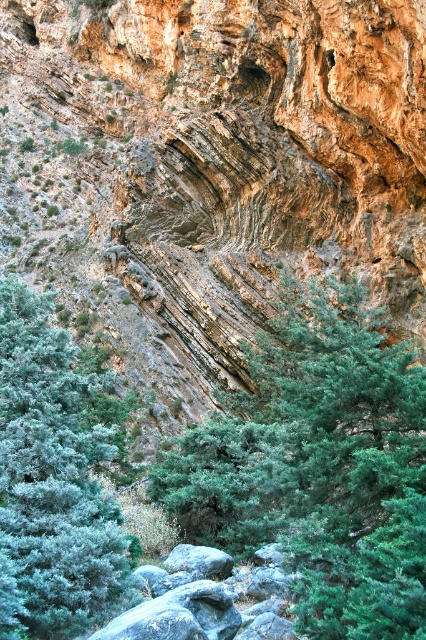
In the scene shown: Between green leafy tree at center and green matte tree at center, which one is positioned lower?

Positioned lower is green leafy tree at center.

Does point (255, 426) come farther from viewer compared to point (68, 595)?

Yes.

Between point (356, 440) and point (5, 632), which one is positioned behind?

Positioned behind is point (356, 440).

The height and width of the screenshot is (640, 426). I want to click on green leafy tree at center, so click(319, 465).